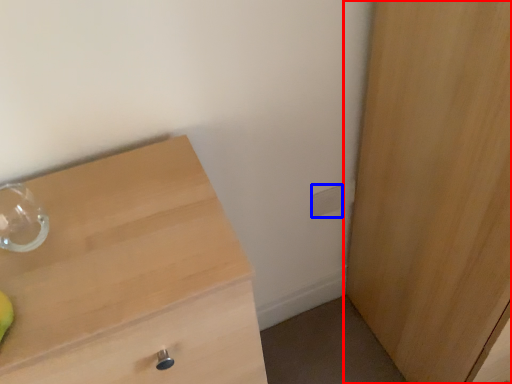
Question: Which point is further to the camera, cupboard (highlighted by a red box) or electric outlet (highlighted by a blue box)?

Choices:
 (A) cupboard
 (B) electric outlet

Answer: (B)